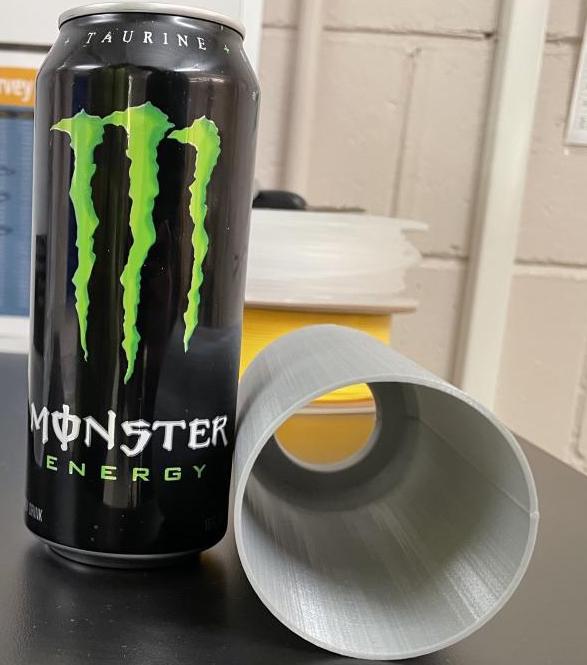
In order to click on white wall in this screenshot , I will do `click(533, 378)`.